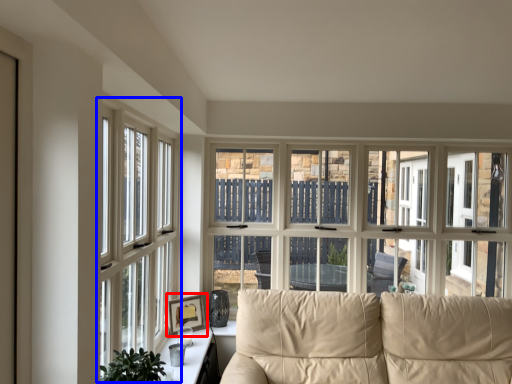
Question: Which of the following is the closest to the observer, picture frame (highlighted by a red box) or window (highlighted by a blue box)?

Choices:
 (A) picture frame
 (B) window

Answer: (B)